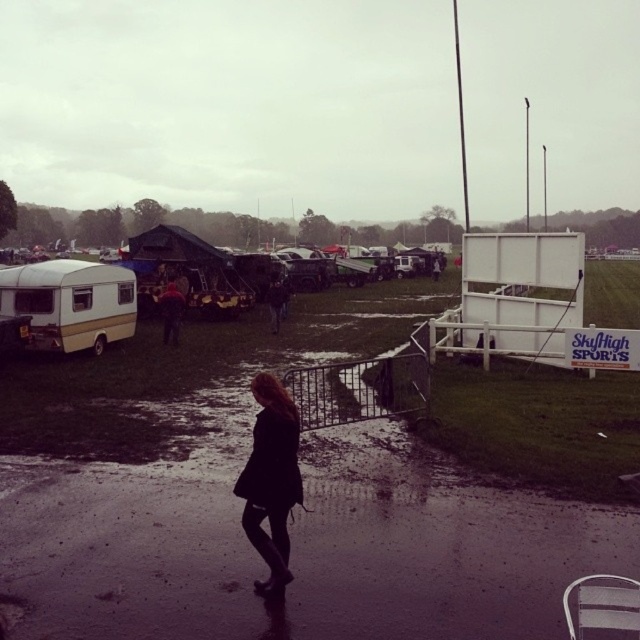
Question: Can you confirm if silhouette fabric dress at center is positioned to the left of dark fabric coat at center?

Choices:
 (A) yes
 (B) no

Answer: (B)

Question: Based on their relative distances, which object is farther from the gold metallic caravan at left?

Choices:
 (A) matte white trailer at left
 (B) silhouette fabric dress at center
 (C) dark fabric coat at center
 (D) dark blue jeans at center

Answer: (B)

Question: Is gold metallic caravan at left below dark fabric coat at center?

Choices:
 (A) yes
 (B) no

Answer: (A)

Question: Considering the real-world distances, which object is farthest from the dark fabric coat at center?

Choices:
 (A) dark blue jeans at center
 (B) gold metallic caravan at left
 (C) matte white trailer at left
 (D) silhouette fabric dress at center

Answer: (D)

Question: Which object is the closest to the matte white trailer at left?

Choices:
 (A) gold metallic caravan at left
 (B) dark blue jeans at center
 (C) silhouette fabric dress at center

Answer: (A)

Question: Is matte white trailer at left thinner than dark fabric coat at center?

Choices:
 (A) yes
 (B) no

Answer: (B)